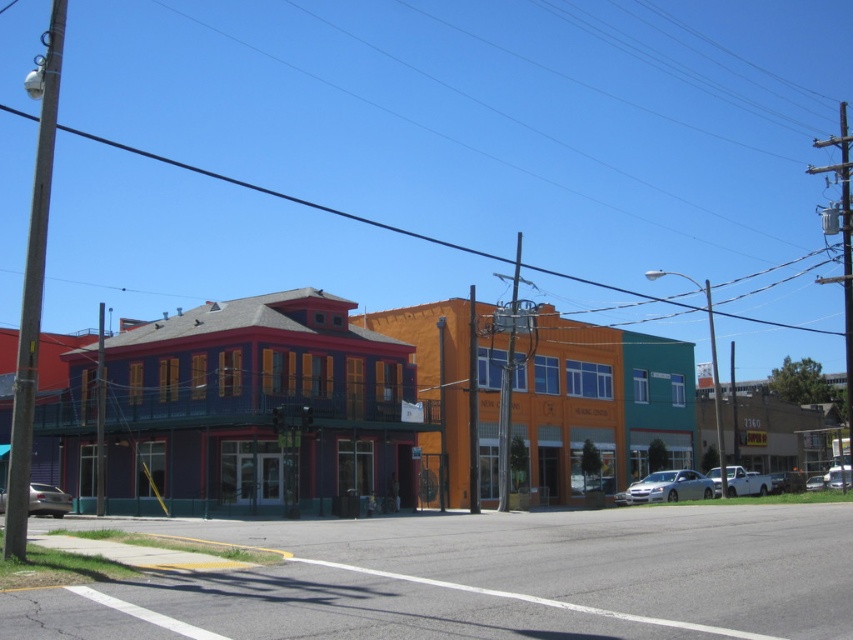
Based on the photo, you are a pedestrian standing on the street in front of the purple matte building at left. You want to walk to the metallic silver car at lower right. Which direction should you move to reach the car?

The purple matte building at left is positioned over the metallic silver car at lower right, so you should move to the right and forward to reach the metallic silver car at lower right.

You are a delivery driver who needs to park your white matte truck at lower right in a parking spot that can only accommodate vehicles shorter than the silver metallic sedan at center. Is your truck suitable for this parking spot?

The silver metallic sedan at center is shorter than the white matte truck at lower right. Since the parking spot requires vehicles shorter than the sedan, the white matte truck at lower right is too long and cannot fit.